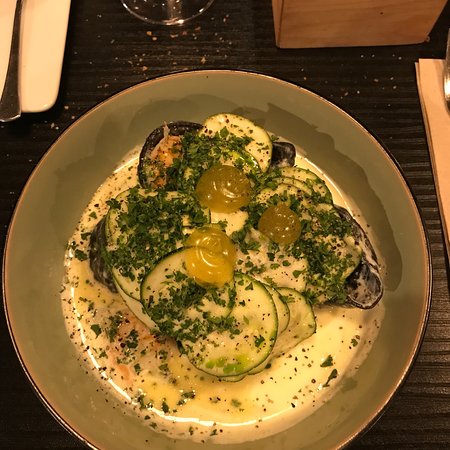
Locate an element on the screen. This screenshot has width=450, height=450. top of plate is located at coordinates (222, 71).